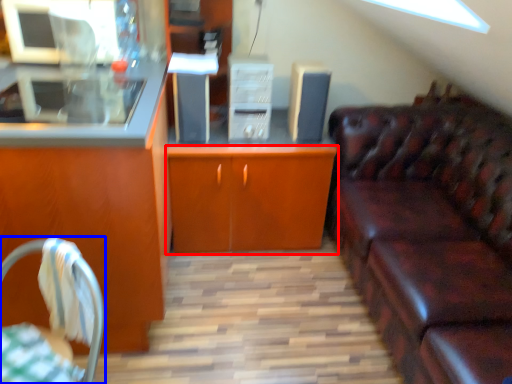
Question: Among these objects, which one is nearest to the camera, cabinetry (highlighted by a red box) or chair (highlighted by a blue box)?

Choices:
 (A) cabinetry
 (B) chair

Answer: (B)